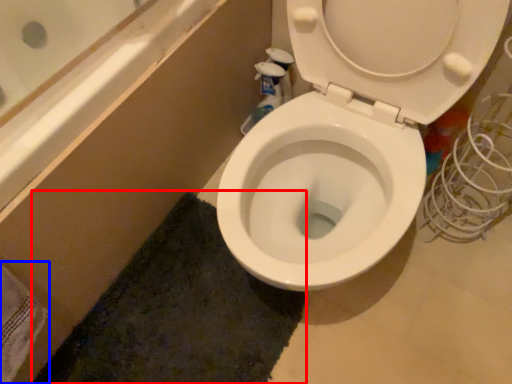
Question: Which point is further to the camera, bath mat (highlighted by a red box) or bath towel (highlighted by a blue box)?

Choices:
 (A) bath mat
 (B) bath towel

Answer: (A)